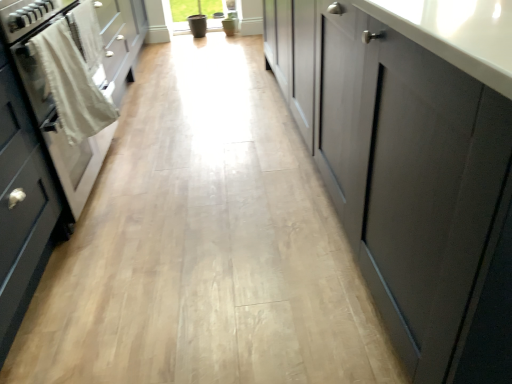
Question: Is white glossy oven at left in front of or behind matte gray cabinet at left, which is the 2th cabinetry in right-to-left order, in the image?

Choices:
 (A) front
 (B) behind

Answer: (B)

Question: Would you say white glossy oven at left is inside or outside matte gray cabinet at left, the 1th cabinetry when ordered from left to right?

Choices:
 (A) inside
 (B) outside

Answer: (B)

Question: Estimate the real-world distances between objects in this image. Which object is farther from the matte gray cabinet at center, the second cabinetry from the left?

Choices:
 (A) white cotton towel at left
 (B) white glossy oven at left
 (C) matte gray cabinet at left, the 1th cabinetry when ordered from left to right

Answer: (B)

Question: Which is farther from the matte gray cabinet at center, the second cabinetry from the left?

Choices:
 (A) white cotton towel at left
 (B) white glossy oven at left
 (C) matte gray cabinet at left, which is the 2th cabinetry in right-to-left order

Answer: (B)